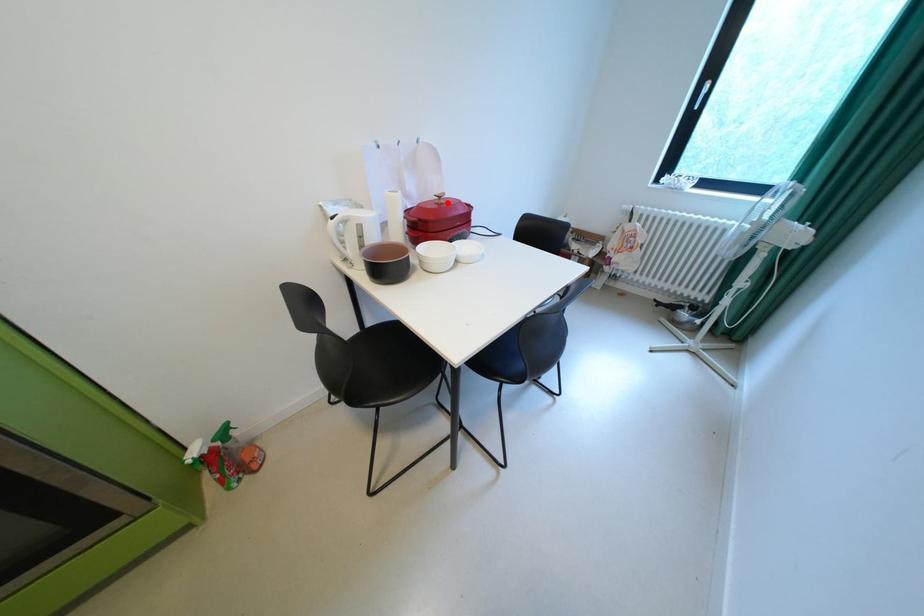
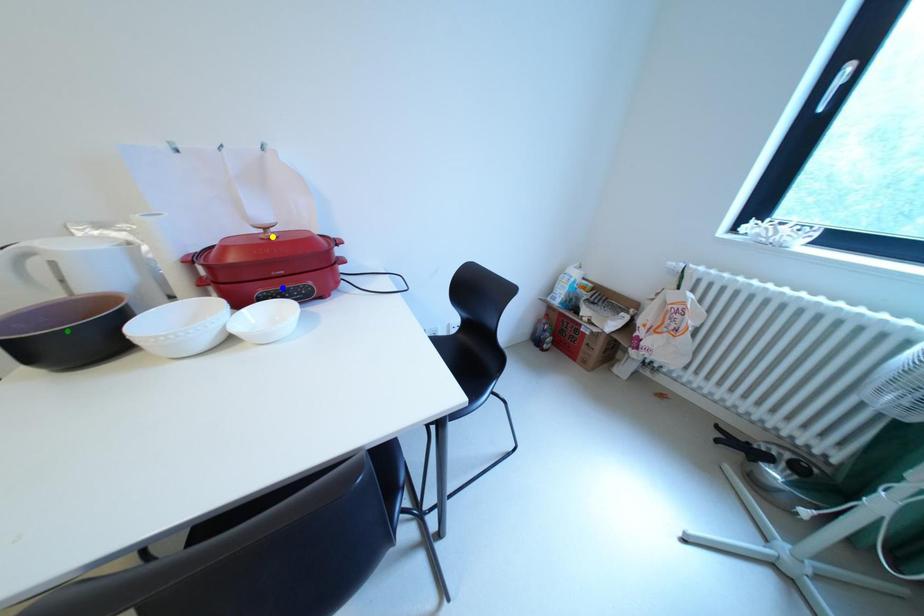
Question: I am providing you with two images of the same scene from different viewpoints. A red point is marked on the first image. You are given multiple points on the second image. Which spot in image 2 lines up with the point in image 1?

Choices:
 (A) green point
 (B) blue point
 (C) yellow point

Answer: (C)